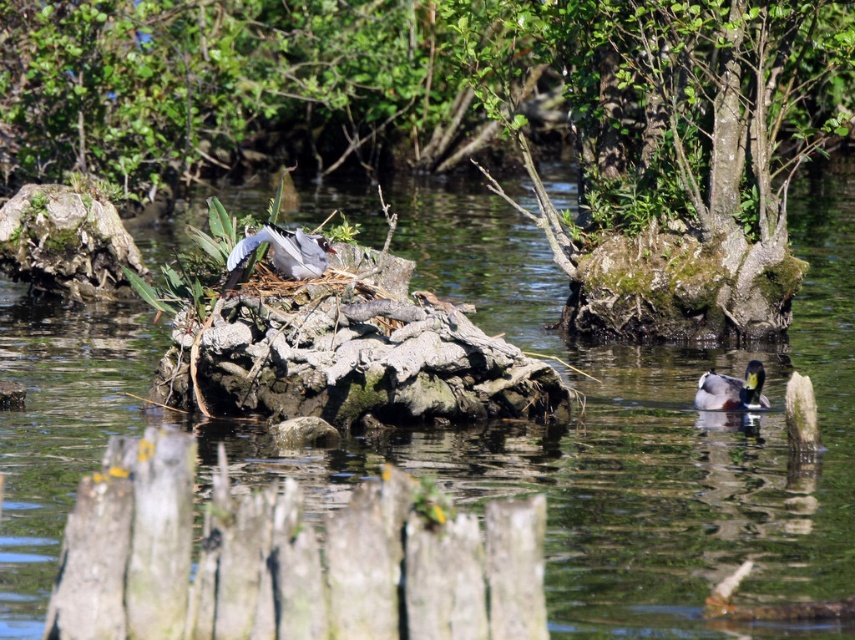
You are a photographer aiming to capture the white feathered bird at center without the green mossy tree at upper center blocking the view. Is the bird visible from your current position?

The green mossy tree at upper center is positioned over the white feathered bird at center, so the tree may block the view of the bird depending on the angle. Adjust your position to ensure the bird is visible without obstruction.

You are standing at the edge of the water and see the green mossy tree at upper center and the green glossy duck at lower right. Which object is positioned to the right side of the other?

The green mossy tree at upper center is to the right of green glossy duck at lower right.